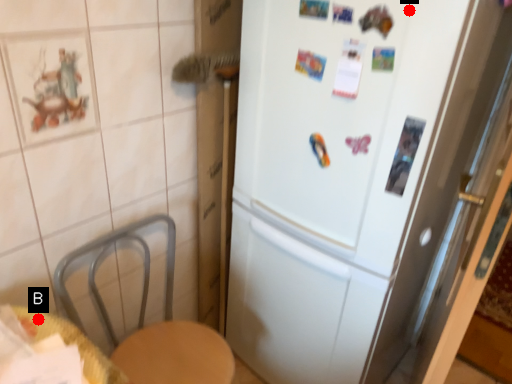
Question: Two points are circled on the image, labeled by A and B beside each circle. Which point is closer to the camera?

Choices:
 (A) A is closer
 (B) B is closer

Answer: (A)